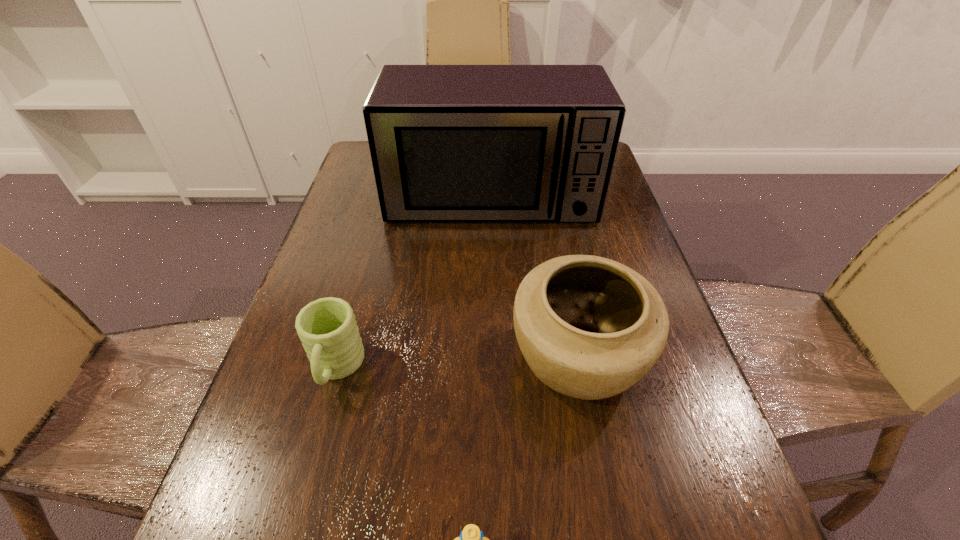
Locate an element on the screen. microwave_oven that is at the right edge is located at coordinates (449, 143).

Find the location of a particular element. pottery located at the right edge is located at coordinates (589, 327).

Where is `object located in the far left corner section of the desktop`? The width and height of the screenshot is (960, 540). object located in the far left corner section of the desktop is located at coordinates (449, 143).

Locate an element on the screen. object that is at the far right corner is located at coordinates (449, 143).

The image size is (960, 540). Find the location of `free region at the left edge`. free region at the left edge is located at coordinates (353, 239).

At what (x,y) coordinates should I click in order to perform the action: click on free region at the right edge. Please return your answer as a coordinate pair (x, y). This screenshot has width=960, height=540. Looking at the image, I should click on (688, 520).

The height and width of the screenshot is (540, 960). What are the coordinates of `vacant space that is in between the microwave_oven and the third tallest object` in the screenshot? It's located at (414, 283).

Where is `vacant space in between the third tallest object and the third shortest object`? The height and width of the screenshot is (540, 960). vacant space in between the third tallest object and the third shortest object is located at coordinates (457, 364).

Identify the location of free area in between the pottery and the mug. Image resolution: width=960 pixels, height=540 pixels. (457, 364).

Locate an element on the screen. object that is the second nearest to the mug is located at coordinates (471, 539).